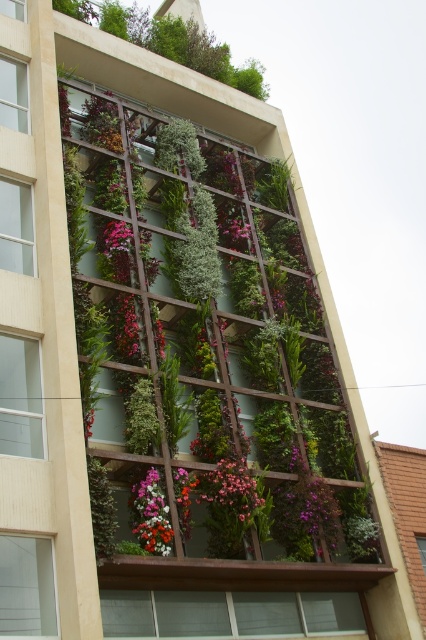
Question: Where is pink matte flowers at center located in relation to floral bouquet at center in the image?

Choices:
 (A) above
 (B) below

Answer: (A)

Question: Which of the following is the farthest from the observer?

Choices:
 (A) pink matte flowers at center
 (B) floral bouquet at center

Answer: (A)

Question: Is pink matte flowers at center thinner than floral bouquet at center?

Choices:
 (A) no
 (B) yes

Answer: (A)

Question: Is the position of pink matte flowers at center less distant than that of floral bouquet at center?

Choices:
 (A) no
 (B) yes

Answer: (A)